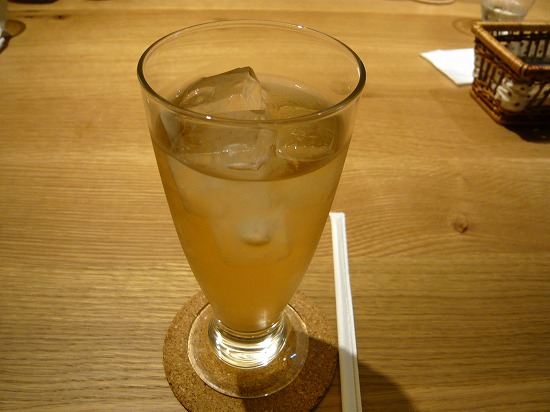
Where is `cork coaster`? The height and width of the screenshot is (412, 550). cork coaster is located at coordinates (195, 395), (170, 336), (289, 400), (329, 338), (221, 409).